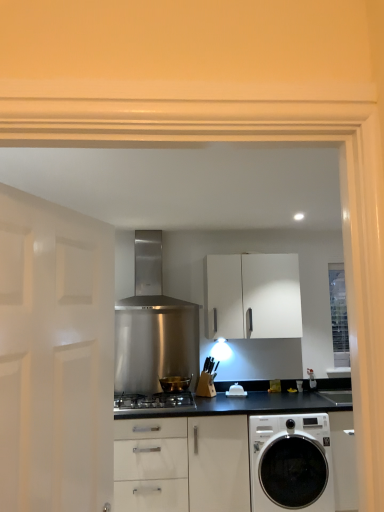
Question: Can you confirm if stainless steel range hood at center is shorter than clear glass window at right?

Choices:
 (A) no
 (B) yes

Answer: (B)

Question: Does stainless steel range hood at center have a larger size compared to clear glass window at right?

Choices:
 (A) no
 (B) yes

Answer: (B)

Question: From the image's perspective, is stainless steel range hood at center above clear glass window at right?

Choices:
 (A) yes
 (B) no

Answer: (A)

Question: Is stainless steel range hood at center not near clear glass window at right?

Choices:
 (A) yes
 (B) no

Answer: (A)

Question: Is stainless steel range hood at center looking in the opposite direction of clear glass window at right?

Choices:
 (A) no
 (B) yes

Answer: (A)

Question: From a real-world perspective, is white matte cabinet at center physically located above or below stainless steel range hood at center?

Choices:
 (A) above
 (B) below

Answer: (B)

Question: In terms of height, does white matte cabinet at center look taller or shorter compared to stainless steel range hood at center?

Choices:
 (A) short
 (B) tall

Answer: (B)

Question: Relative to stainless steel range hood at center, is white matte cabinet at center in front or behind?

Choices:
 (A) front
 (B) behind

Answer: (B)

Question: Considering the positions of white matte cabinet at center and stainless steel range hood at center in the image, is white matte cabinet at center bigger or smaller than stainless steel range hood at center?

Choices:
 (A) big
 (B) small

Answer: (B)

Question: Choose the correct answer: Is white matte door at left inside stainless steel range hood at center or outside it?

Choices:
 (A) outside
 (B) inside

Answer: (A)

Question: Is point (54, 418) closer or farther from the camera than point (122, 233)?

Choices:
 (A) closer
 (B) farther

Answer: (A)

Question: Relative to stainless steel range hood at center, is white matte door at left in front or behind?

Choices:
 (A) behind
 (B) front

Answer: (B)

Question: In the image, is white matte door at left on the left side or the right side of stainless steel range hood at center?

Choices:
 (A) left
 (B) right

Answer: (A)

Question: Relative to shiny metallic pot at center, is stainless steel gas stove at center in front or behind?

Choices:
 (A) behind
 (B) front

Answer: (B)

Question: Do you think stainless steel gas stove at center is within shiny metallic pot at center, or outside of it?

Choices:
 (A) inside
 (B) outside

Answer: (B)